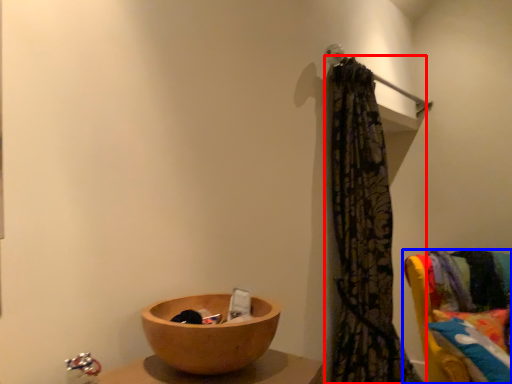
Question: Which of the following is the farthest to the observer, curtain (highlighted by a red box) or furniture (highlighted by a blue box)?

Choices:
 (A) curtain
 (B) furniture

Answer: (B)